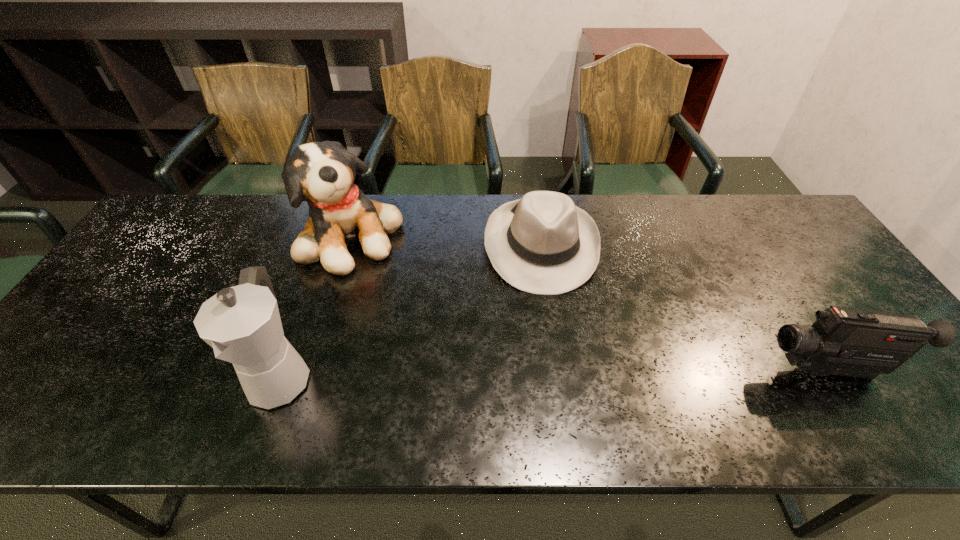
The image size is (960, 540). I want to click on free space on the desktop that is between the coffeepot and the rightmost object and is positioned on the front-facing side of the fedora, so click(x=559, y=374).

Where is `free spot on the desktop that is between the coffeepot and the rightmost object and is positioned at the face of the puppy`? The image size is (960, 540). free spot on the desktop that is between the coffeepot and the rightmost object and is positioned at the face of the puppy is located at coordinates coord(525,374).